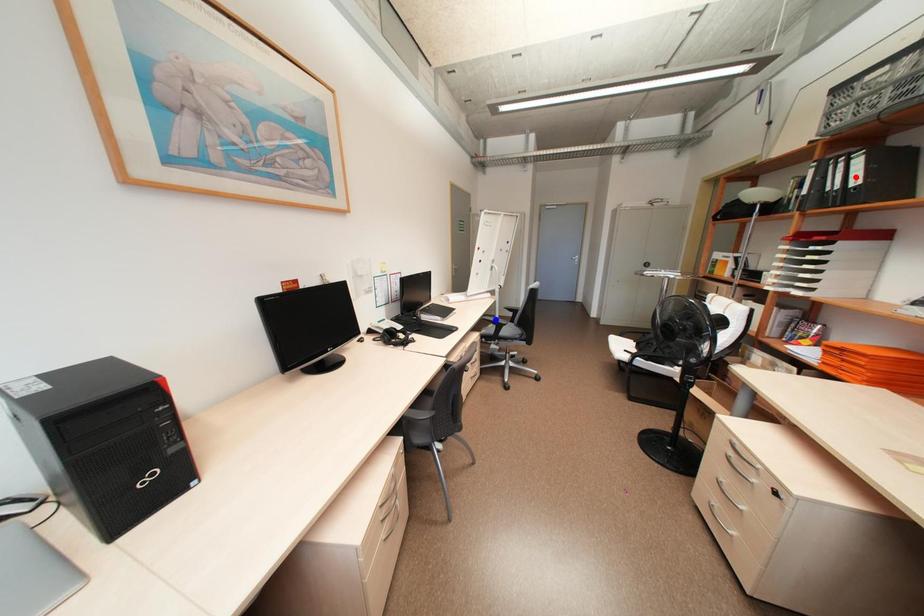
Question: Two points are marked on the image. Which point is closer to the camera?

Choices:
 (A) Blue point is closer.
 (B) Red point is closer.

Answer: (B)